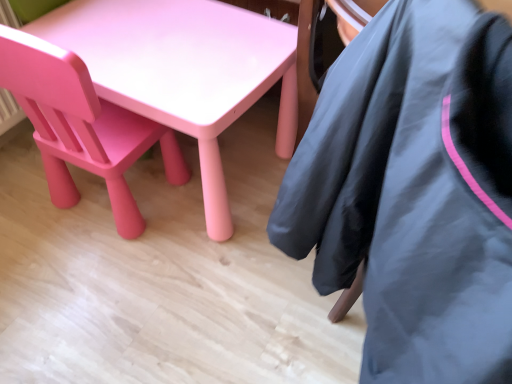
This screenshot has width=512, height=384. What do you see at coordinates (81, 125) in the screenshot? I see `matte pink plastic chair at lower left` at bounding box center [81, 125].

Locate an element on the screen. Image resolution: width=512 pixels, height=384 pixels. matte pink plastic chair at lower left is located at coordinates (81, 125).

Find the location of `matte black jacket at lower right`. matte black jacket at lower right is located at coordinates (414, 191).

The image size is (512, 384). What do you see at coordinates (414, 191) in the screenshot?
I see `matte black jacket at lower right` at bounding box center [414, 191].

Locate an element on the screen. matte pink plastic chair at lower left is located at coordinates (81, 125).

Looking at this image, can you confirm if matte black jacket at lower right is positioned to the right of matte pink plastic chair at lower left?

Yes.

Which is behind, matte black jacket at lower right or matte pink plastic chair at lower left?

matte pink plastic chair at lower left.

Considering the points (351, 62) and (64, 141), which point is in front, point (351, 62) or point (64, 141)?

The point (351, 62) is in front.

From the picture: From the image's perspective, which one is positioned higher, matte black jacket at lower right or matte pink plastic chair at lower left?

matte pink plastic chair at lower left appears higher in the image.

From a real-world perspective, is matte black jacket at lower right physically above matte pink plastic chair at lower left?

Indeed, from a real-world perspective, matte black jacket at lower right stands above matte pink plastic chair at lower left.

Does matte black jacket at lower right have a lesser width compared to matte pink plastic chair at lower left?

Incorrect, the width of matte black jacket at lower right is not less than that of matte pink plastic chair at lower left.

Considering the sizes of matte black jacket at lower right and matte pink plastic chair at lower left in the image, is matte black jacket at lower right taller or shorter than matte pink plastic chair at lower left?

Considering their sizes, matte black jacket at lower right has more height than matte pink plastic chair at lower left.

Based on their sizes in the image, would you say matte black jacket at lower right is bigger or smaller than matte pink plastic chair at lower left?

matte black jacket at lower right is bigger than matte pink plastic chair at lower left.

Looking at this image, is matte black jacket at lower right situated inside matte pink plastic chair at lower left or outside?

matte black jacket at lower right is located beyond the bounds of matte pink plastic chair at lower left.

Is matte black jacket at lower right not close to matte pink plastic chair at lower left?

matte black jacket at lower right is actually quite close to matte pink plastic chair at lower left.

Is matte black jacket at lower right positioned with its back to matte pink plastic chair at lower left?

No, matte pink plastic chair at lower left is not at the back of matte black jacket at lower right.

Where is `jacket below the matte pink plastic chair at lower left (from the image's perspective)`? jacket below the matte pink plastic chair at lower left (from the image's perspective) is located at coordinates (414, 191).

Visually, is matte pink plastic chair at lower left positioned to the left or to the right of matte black jacket at lower right?

matte pink plastic chair at lower left is to the left of matte black jacket at lower right.

Is matte pink plastic chair at lower left in front of or behind matte black jacket at lower right in the image?

Clearly, matte pink plastic chair at lower left is behind matte black jacket at lower right.

Which is nearer, [37,77] or [390,33]?

The point [390,33] is closer.

From the image's perspective, which object appears higher, matte pink plastic chair at lower left or matte black jacket at lower right?

matte pink plastic chair at lower left.

From a real-world perspective, is matte pink plastic chair at lower left over matte black jacket at lower right?

Actually, matte pink plastic chair at lower left is physically below matte black jacket at lower right in the real world.

Consider the image. Does matte pink plastic chair at lower left have a greater width compared to matte black jacket at lower right?

Incorrect, the width of matte pink plastic chair at lower left does not surpass that of matte black jacket at lower right.

Considering the relative sizes of matte pink plastic chair at lower left and matte black jacket at lower right in the image provided, is matte pink plastic chair at lower left taller than matte black jacket at lower right?

No.

Does matte pink plastic chair at lower left have a smaller size compared to matte black jacket at lower right?

Yes.

Choose the correct answer: Is matte pink plastic chair at lower left inside matte black jacket at lower right or outside it?

The correct answer is: outside.

Is matte pink plastic chair at lower left far from matte black jacket at lower right?

No, there isn't a large distance between matte pink plastic chair at lower left and matte black jacket at lower right.

Is matte pink plastic chair at lower left facing away from matte black jacket at lower right?

No, matte black jacket at lower right is not at the back of matte pink plastic chair at lower left.

Measure the distance from matte pink plastic chair at lower left to matte black jacket at lower right.

matte pink plastic chair at lower left is 26.46 inches away from matte black jacket at lower right.

Identify the location of jacket in front of the matte pink plastic chair at lower left. (414, 191).

You are a GUI agent. You are given a task and a screenshot of the screen. Output one action in this format:
    pyautogui.click(x=<x>, y=<y>)
    Task: Click on the chair that appears below the matte black jacket at lower right (from a real-world perspective)
    
    Given the screenshot: What is the action you would take?
    pyautogui.click(x=81, y=125)

I want to click on chair on the left of matte black jacket at lower right, so click(x=81, y=125).